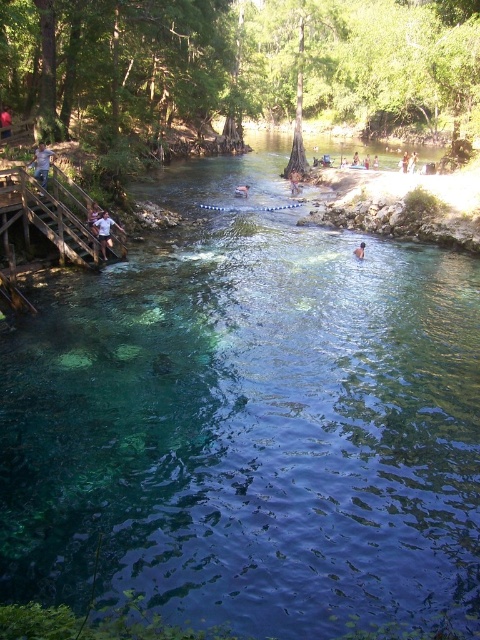
Who is positioned more to the right, white cotton shirt at upper center or smooth skin person at center?

smooth skin person at center

You are a GUI agent. You are given a task and a screenshot of the screen. Output one action in this format:
    pyautogui.click(x=<x>, y=<y>)
    Task: Click on the white cotton shirt at upper center
    This screenshot has width=480, height=640.
    Given the screenshot: What is the action you would take?
    pyautogui.click(x=105, y=230)

Locate an element on the screen. Image resolution: width=480 pixels, height=640 pixels. white cotton shirt at upper center is located at coordinates (105, 230).

Is white cotton shirt at upper center positioned before brown leather jacket at center?

Yes.

Does white cotton shirt at upper center have a lesser width compared to brown leather jacket at center?

Indeed, white cotton shirt at upper center has a lesser width compared to brown leather jacket at center.

Between point (106, 228) and point (292, 170), which one is positioned in front?

Positioned in front is point (106, 228).

This screenshot has height=640, width=480. What are the coordinates of `white cotton shirt at upper center` in the screenshot? It's located at (105, 230).

Who is more distant from viewer, (36, 168) or (8, 134)?

The point (8, 134) is more distant.

The image size is (480, 640). In order to click on light blue denim jeans at left in this screenshot , I will do `click(41, 163)`.

You are a GUI agent. You are given a task and a screenshot of the screen. Output one action in this format:
    pyautogui.click(x=<x>, y=<y>)
    Task: Click on the light blue denim jeans at left
    The height and width of the screenshot is (640, 480).
    Given the screenshot: What is the action you would take?
    pyautogui.click(x=41, y=163)

I want to click on light blue denim jeans at left, so click(x=41, y=163).